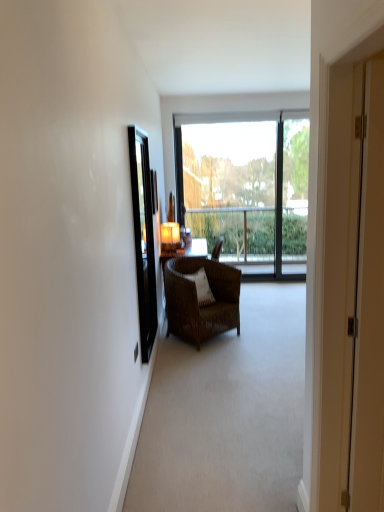
Find the location of a particular element. This screenshot has height=512, width=384. free space below black glass screen door at left, which is the first screen door in left-to-right order (from a real-world perspective) is located at coordinates (159, 373).